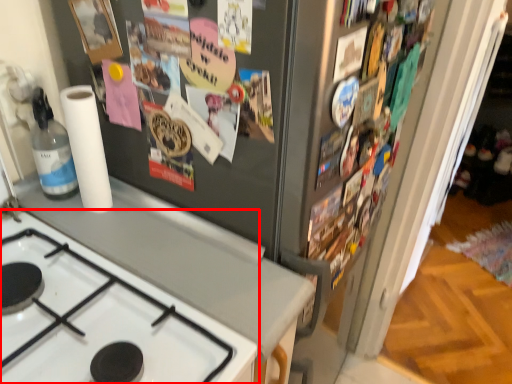
Question: From the image's perspective, where is gas stove (annotated by the red box) located in relation to paper towel in the image?

Choices:
 (A) below
 (B) above

Answer: (A)